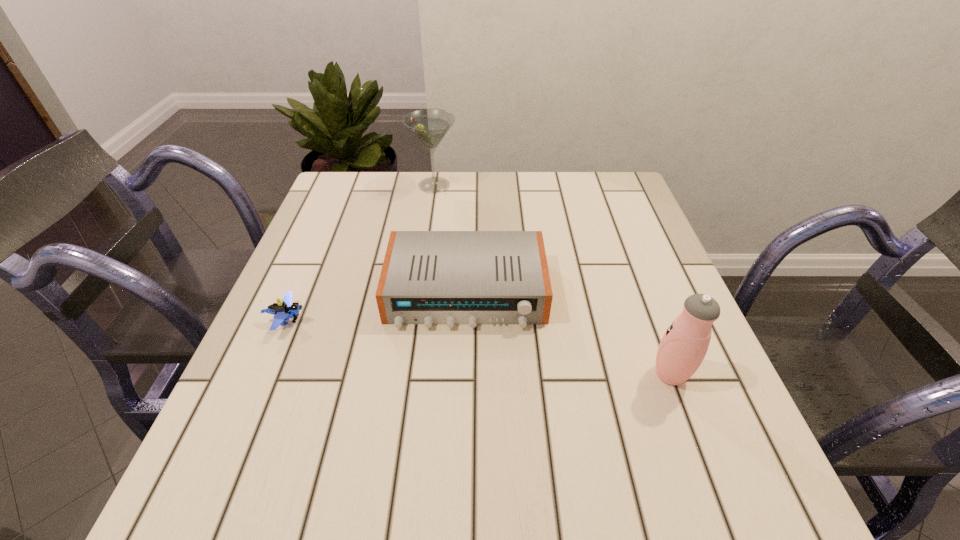
Image resolution: width=960 pixels, height=540 pixels. In order to click on object present at the far edge in this screenshot , I will do `click(430, 125)`.

At what (x,y) coordinates should I click in order to perform the action: click on object positioned at the left edge. Please return your answer as a coordinate pair (x, y). Looking at the image, I should click on (284, 310).

Where is `object that is at the right edge`? The image size is (960, 540). object that is at the right edge is located at coordinates (684, 345).

You are a GUI agent. You are given a task and a screenshot of the screen. Output one action in this format:
    pyautogui.click(x=<x>, y=<y>)
    Task: Click on the vacant space at the far edge of the desktop
    Image resolution: width=960 pixels, height=540 pixels.
    Given the screenshot: What is the action you would take?
    pyautogui.click(x=424, y=205)

At what (x,y) coordinates should I click in order to perform the action: click on blank area at the near edge. Please return your answer as a coordinate pair (x, y). This screenshot has height=540, width=960. Looking at the image, I should click on (419, 507).

Where is `vacant region at the left edge of the desktop`? This screenshot has height=540, width=960. vacant region at the left edge of the desktop is located at coordinates (372, 221).

Where is `vacant space at the right edge of the desktop`? vacant space at the right edge of the desktop is located at coordinates (613, 255).

The image size is (960, 540). Identify the location of free spot at the far left corner of the desktop. (357, 175).

Find the location of a particular element. The image size is (960, 540). vacant area at the near right corner is located at coordinates (713, 482).

This screenshot has height=540, width=960. I want to click on vacant space that is in between the thermos bottle and the martini, so click(552, 280).